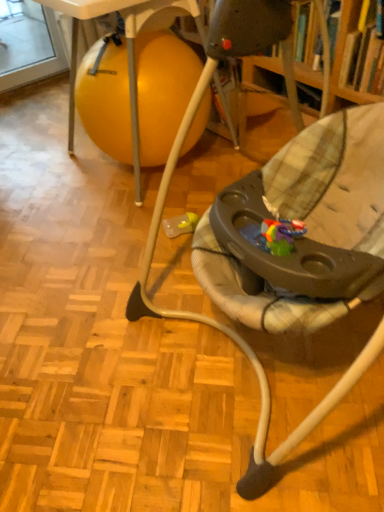
Question: Considering the positions of black plastic walker at center and white plastic table at upper left in the image, is black plastic walker at center taller or shorter than white plastic table at upper left?

Choices:
 (A) tall
 (B) short

Answer: (A)

Question: Considering their positions, is black plastic walker at center located in front of or behind white plastic table at upper left?

Choices:
 (A) behind
 (B) front

Answer: (B)

Question: Considering the positions of point (254, 24) and point (137, 185), is point (254, 24) closer or farther from the camera than point (137, 185)?

Choices:
 (A) farther
 (B) closer

Answer: (B)

Question: Considering the positions of white plastic table at upper left and black plastic walker at center in the image, is white plastic table at upper left taller or shorter than black plastic walker at center?

Choices:
 (A) short
 (B) tall

Answer: (A)

Question: From the image's perspective, relative to black plastic walker at center, is white plastic table at upper left above or below?

Choices:
 (A) above
 (B) below

Answer: (A)

Question: Is point (114, 2) closer or farther from the camera than point (269, 484)?

Choices:
 (A) closer
 (B) farther

Answer: (B)

Question: In terms of size, does white plastic table at upper left appear bigger or smaller than black plastic walker at center?

Choices:
 (A) small
 (B) big

Answer: (A)